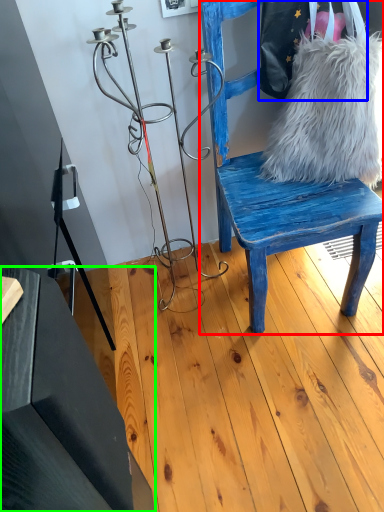
Question: Considering the real-world distances, which object is closest to chair (highlighted by a red box)? shoulder bag (highlighted by a blue box) or table (highlighted by a green box).

Choices:
 (A) shoulder bag
 (B) table

Answer: (A)